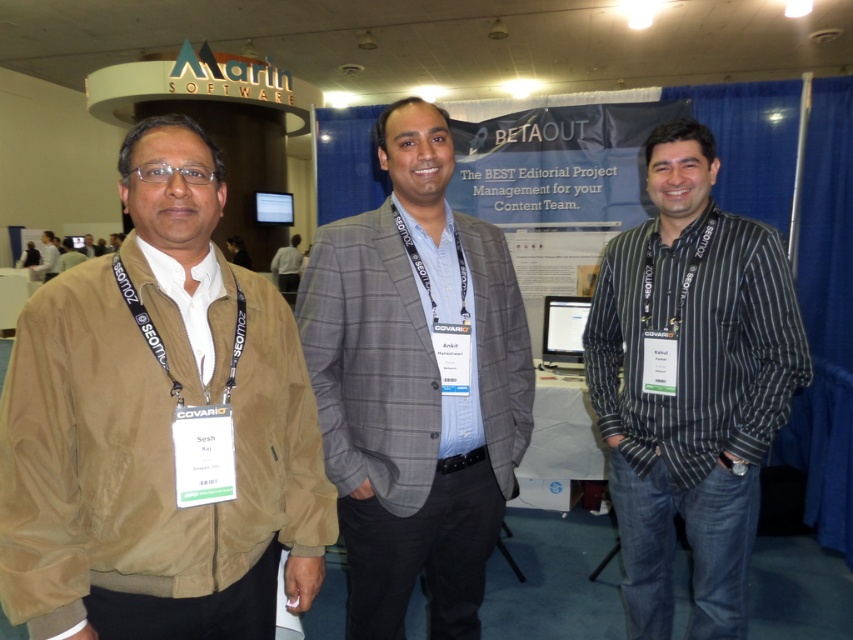
You are organizing a photo shoot and need to ensure that the tan suede jacket at left and the white shirt at center are visible in the frame. Based on their sizes, which object might require more careful framing to ensure it doesn

The tan suede jacket at left has a lesser width compared to the white shirt at center, so it might require more careful framing to ensure it is visible in the photo shoot.

You are an event photographer at the conference. You need to capture a photo of the tan suede jacket at left and the white shirt at center. Based on their positions, where should you position your camera to ensure both are fully visible in the frame?

Since the tan suede jacket at left is located below the white shirt at center, you should position your camera at a lower angle to capture both the tan suede jacket at left and the white shirt at center in the frame.

You are standing in front of the BETAOUT conference backdrop and want to take a photo. You notice two points marked on the backdrop at coordinates point (627,449) and point (294,266). Which point should you focus on to ensure the closer one is in sharp focus?

Point (627,449) is closer to the camera than point (294,266), so you should focus on point (627,449) to ensure the closer one is in sharp focus.